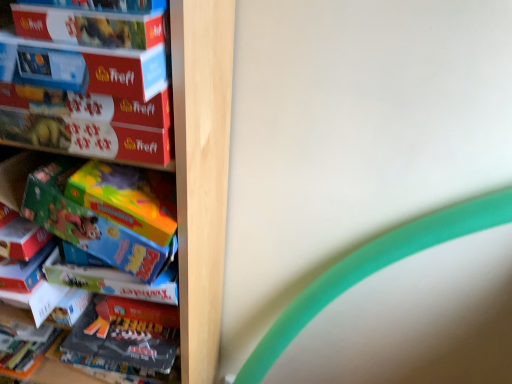
Question: Should I look upward or downward to see matte red puzzle box at upper left, positioned as the first paperback book in bottom-to-top order?

Choices:
 (A) down
 (B) up

Answer: (B)

Question: Considering the relative positions of matte cardboard puzzle box at left and wooden puzzle boxes at left in the image provided, is matte cardboard puzzle box at left behind wooden puzzle boxes at left?

Choices:
 (A) no
 (B) yes

Answer: (A)

Question: Does matte cardboard puzzle box at left have a lesser height compared to wooden puzzle boxes at left?

Choices:
 (A) no
 (B) yes

Answer: (B)

Question: Is matte cardboard puzzle box at left turned away from wooden puzzle boxes at left?

Choices:
 (A) no
 (B) yes

Answer: (B)

Question: Does matte cardboard puzzle box at left appear on the left side of wooden puzzle boxes at left?

Choices:
 (A) no
 (B) yes

Answer: (A)

Question: From the image's perspective, would you say matte cardboard puzzle box at left is positioned over wooden puzzle boxes at left?

Choices:
 (A) yes
 (B) no

Answer: (A)

Question: Does matte cardboard puzzle box at left contain wooden puzzle boxes at left?

Choices:
 (A) yes
 (B) no

Answer: (B)

Question: From a real-world perspective, is matte cardboard box at upper left, acting as the second paperback book starting from the bottom, on top of matte cardboard puzzle box at left?

Choices:
 (A) yes
 (B) no

Answer: (A)

Question: Can you confirm if matte cardboard box at upper left, the first paperback book when ordered from top to bottom, is shorter than matte cardboard puzzle box at left?

Choices:
 (A) no
 (B) yes

Answer: (B)

Question: Are matte cardboard box at upper left, the first paperback book when ordered from top to bottom, and matte cardboard puzzle box at left located far from each other?

Choices:
 (A) no
 (B) yes

Answer: (A)

Question: Is matte cardboard box at upper left, the first paperback book when ordered from top to bottom, at the right side of matte cardboard puzzle box at left?

Choices:
 (A) no
 (B) yes

Answer: (B)

Question: Can you confirm if matte cardboard box at upper left, the first paperback book when ordered from top to bottom, is smaller than matte cardboard puzzle box at left?

Choices:
 (A) no
 (B) yes

Answer: (B)

Question: Is matte cardboard box at upper left, the first paperback book when ordered from top to bottom, at the left side of matte cardboard puzzle box at left?

Choices:
 (A) yes
 (B) no

Answer: (B)

Question: Does matte cardboard box at upper left, the first paperback book when ordered from top to bottom, come in front of green matte toy at left?

Choices:
 (A) yes
 (B) no

Answer: (A)